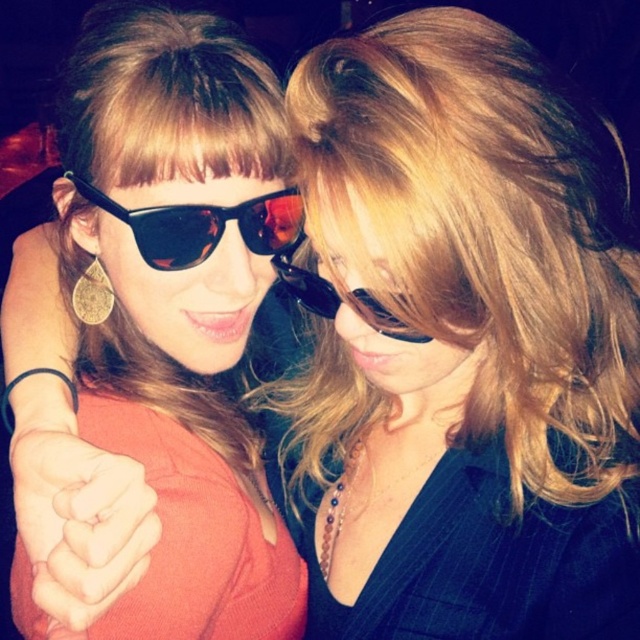
You are a photographer trying to capture the interaction between the two people in the image. You want to focus your camera on the smooth skin fist at center and the black plastic sunglasses at center. Which object should you adjust your focus to first if you want to start with the one closer to the left side?

The smooth skin fist at center is to the left of black plastic sunglasses at center, so you should adjust your focus to the smooth skin fist at center first since it is closer to the left side.

You are a photographer adjusting the lighting for a portrait. You notice the smooth skin fist at center and the black plastic sunglasses at center in the frame. Which object should you adjust the light to highlight first if you want to ensure both are visible, considering their positions?

The smooth skin fist at center is below the black plastic sunglasses at center, so you should adjust the light to highlight the black plastic sunglasses at center first to prevent it from being overshadowed by the lower positioned fist.

Based on the photo, you are taking a photo of two people in a dimly lit setting. You notice two points of light in the image, one at coordinates point [97,488] and another at point [186,260]. Which point is closer to your camera?

Point [97,488] is closer to the camera than point [186,260].